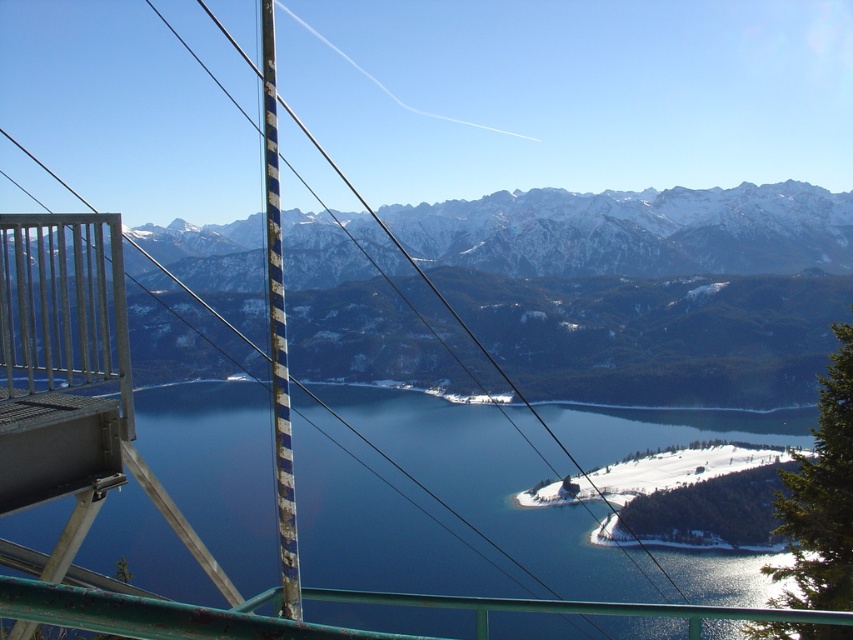
You are standing at the observation deck and want to take a photo of the blue glassy water at center and the snowy mountain range at upper center. Which one of these two objects will occupy more width in your photo?

The snowy mountain range at upper center will occupy more width in your photo since its width is greater than the blue glassy water at center according to the description.

You are standing at the observation deck and want to take a photo of two points marked in the scene. Which point, point (x=462, y=534) or point (x=317, y=284), is nearer to you?

Point (x=462, y=534) is closer to the viewer than point (x=317, y=284).

You are standing at the observation deck and want to take a photo of both the blue glassy water at center and the white snow ski slope at lower right. Since the vertical pole with black and white stripes is in the way, can you move to the left or right to avoid it and still capture both objects in the frame?

The blue glassy water at center is above the white snow ski slope at lower right. Since the vertical pole with black and white stripes is in the center, moving to the left or right would allow you to avoid the pole while still capturing both objects in the frame as they are positioned vertically relative to each other.